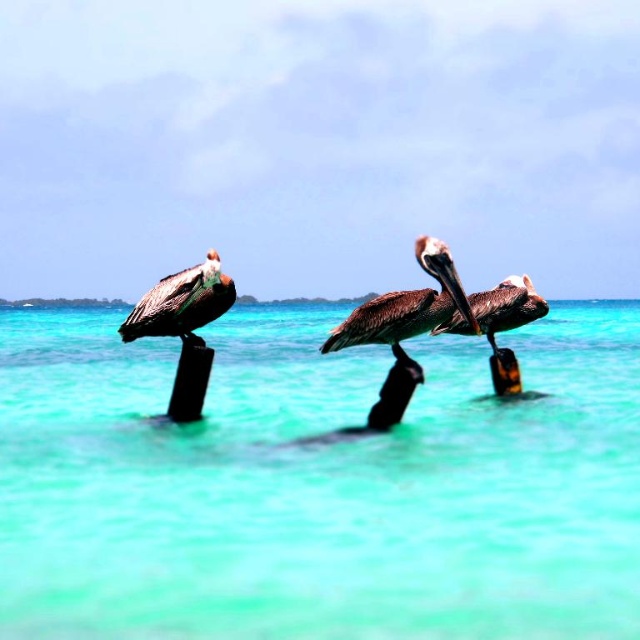
This screenshot has height=640, width=640. What do you see at coordinates (317, 483) in the screenshot?
I see `turquoise water at center` at bounding box center [317, 483].

Can you confirm if turquoise water at center is wider than brown matte pelican at center?

Indeed, turquoise water at center has a greater width compared to brown matte pelican at center.

Is point (618, 596) positioned before point (532, 288)?

Yes, point (618, 596) is in front of point (532, 288).

Identify the location of turquoise water at center. (317, 483).

Does turquoise water at center come in front of brown feathered pelican at left?

Yes, turquoise water at center is closer to the viewer.

This screenshot has height=640, width=640. Describe the element at coordinates (317, 483) in the screenshot. I see `turquoise water at center` at that location.

Based on the photo, who is more distant from viewer, (26,540) or (189,276)?

Point (189,276)

The height and width of the screenshot is (640, 640). What are the coordinates of `turquoise water at center` in the screenshot? It's located at (317, 483).

Looking at this image, measure the distance between point (552, 362) and camera.

They are 22.89 meters apart.

What do you see at coordinates (317, 483) in the screenshot? I see `turquoise water at center` at bounding box center [317, 483].

You are a GUI agent. You are given a task and a screenshot of the screen. Output one action in this format:
    pyautogui.click(x=<x>, y=<y>)
    Task: Click on the turquoise water at center
    This screenshot has width=640, height=640.
    Given the screenshot: What is the action you would take?
    pyautogui.click(x=317, y=483)